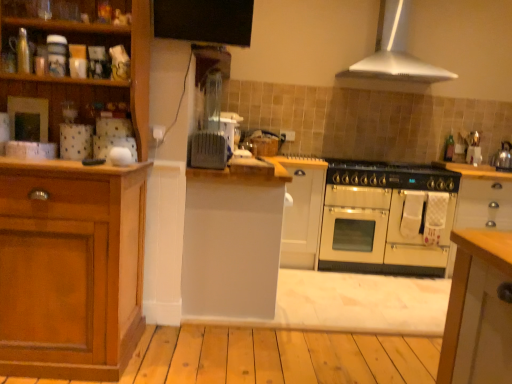
Question: Is wooden cabinet at left, the first cabinetry viewed from the left, oriented away from white matte cabinet at center, the third cabinetry positioned from the left?

Choices:
 (A) yes
 (B) no

Answer: (B)

Question: Is wooden cabinet at left, the first cabinetry viewed from the left, to the left of white matte cabinet at center, positioned as the 2th cabinetry in right-to-left order, from the viewer's perspective?

Choices:
 (A) yes
 (B) no

Answer: (A)

Question: Is wooden cabinet at left, the first cabinetry viewed from the left, aimed at white matte cabinet at center, the third cabinetry positioned from the left?

Choices:
 (A) yes
 (B) no

Answer: (B)

Question: Is wooden cabinet at left, which is the 4th cabinetry from right to left, positioned in front of white matte cabinet at center, positioned as the 2th cabinetry in right-to-left order?

Choices:
 (A) no
 (B) yes

Answer: (B)

Question: Is wooden cabinet at left, which is the 4th cabinetry from right to left, taller than white matte cabinet at center, the third cabinetry positioned from the left?

Choices:
 (A) no
 (B) yes

Answer: (B)

Question: Do you think cream matte oven at center is within white metallic range hood at upper center, or outside of it?

Choices:
 (A) inside
 (B) outside

Answer: (B)

Question: From the image's perspective, is cream matte oven at center positioned above or below white metallic range hood at upper center?

Choices:
 (A) below
 (B) above

Answer: (A)

Question: Is point (376, 218) closer or farther from the camera than point (337, 72)?

Choices:
 (A) closer
 (B) farther

Answer: (A)

Question: Considering the positions of cream matte oven at center and white metallic range hood at upper center in the image, is cream matte oven at center wider or thinner than white metallic range hood at upper center?

Choices:
 (A) thin
 (B) wide

Answer: (B)

Question: Is matte black gas stove at center situated inside white matte cabinet at center, positioned as the 2th cabinetry in right-to-left order, or outside?

Choices:
 (A) outside
 (B) inside

Answer: (A)

Question: Looking at the image, does matte black gas stove at center seem bigger or smaller compared to white matte cabinet at center, positioned as the 2th cabinetry in right-to-left order?

Choices:
 (A) small
 (B) big

Answer: (A)

Question: Is point (348, 183) closer or farther from the camera than point (306, 261)?

Choices:
 (A) farther
 (B) closer

Answer: (B)

Question: In terms of width, does matte black gas stove at center look wider or thinner when compared to white matte cabinet at center, positioned as the 2th cabinetry in right-to-left order?

Choices:
 (A) thin
 (B) wide

Answer: (B)

Question: Is cream matte oven at center taller or shorter than metallic silver kettle at right?

Choices:
 (A) tall
 (B) short

Answer: (A)

Question: Choose the correct answer: Is cream matte oven at center inside metallic silver kettle at right or outside it?

Choices:
 (A) inside
 (B) outside

Answer: (B)